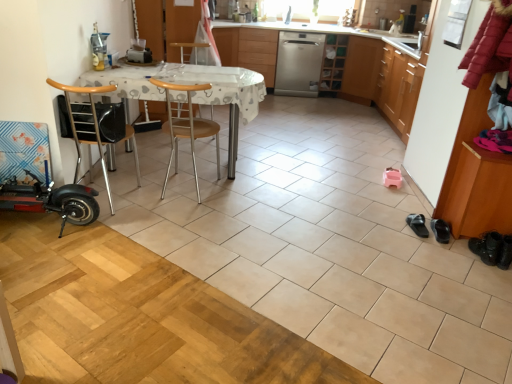
Question: From the image's perspective, is brown wood shoe rack at right, the 2th cabinetry viewed from the top, located beneath wooden chair at left, the first chair positioned from the left?

Choices:
 (A) yes
 (B) no

Answer: (A)

Question: Are brown wood shoe rack at right, the 2th cabinetry viewed from the top, and wooden chair at left, which appears as the second chair when viewed from the right, far apart?

Choices:
 (A) no
 (B) yes

Answer: (B)

Question: Is brown wood shoe rack at right, the 2th cabinetry viewed from the top, wider than wooden chair at left, which appears as the second chair when viewed from the right?

Choices:
 (A) no
 (B) yes

Answer: (A)

Question: Is brown wood shoe rack at right, the 2th cabinetry viewed from the top, placed right next to wooden chair at left, the first chair positioned from the left?

Choices:
 (A) yes
 (B) no

Answer: (B)

Question: Is brown wood shoe rack at right, positioned as the 1th cabinetry in front-to-back order, facing away from wooden chair at left, the first chair positioned from the left?

Choices:
 (A) yes
 (B) no

Answer: (B)

Question: Is brown wood shoe rack at right, arranged as the second cabinetry when viewed from the left, not inside wooden chair at left, which appears as the second chair when viewed from the right?

Choices:
 (A) yes
 (B) no

Answer: (A)

Question: From the image's perspective, is black leather shoe at lower right, marked as the 1th footwear in a left-to-right arrangement, over white plastic table at center?

Choices:
 (A) yes
 (B) no

Answer: (B)

Question: Is black leather shoe at lower right, which is the third footwear from right to left, in front of white plastic table at center?

Choices:
 (A) yes
 (B) no

Answer: (A)

Question: Is black leather shoe at lower right, which is the third footwear from right to left, touching white plastic table at center?

Choices:
 (A) yes
 (B) no

Answer: (B)

Question: From the image's perspective, would you say black leather shoe at lower right, which is the third footwear from right to left, is shown under white plastic table at center?

Choices:
 (A) no
 (B) yes

Answer: (B)

Question: Does black leather shoe at lower right, marked as the 1th footwear in a left-to-right arrangement, come behind white plastic table at center?

Choices:
 (A) no
 (B) yes

Answer: (A)

Question: Is black leather shoes at lower right, acting as the 2th footwear starting from the left, touching brown wood shoe rack at right, positioned as the 1th cabinetry in front-to-back order?

Choices:
 (A) no
 (B) yes

Answer: (A)